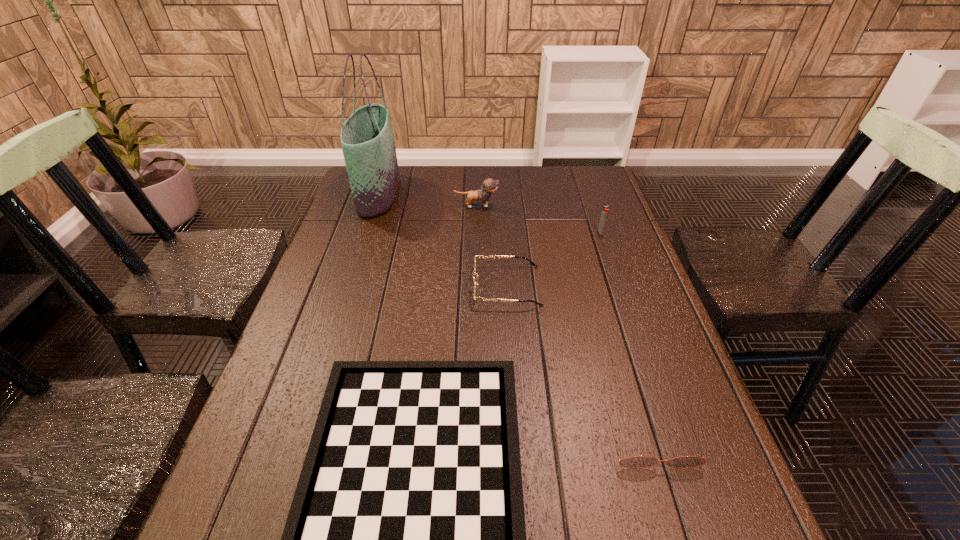
Where is `vacant space at the right edge`? This screenshot has height=540, width=960. vacant space at the right edge is located at coordinates tap(643, 434).

At what (x,y) coordinates should I click in order to perform the action: click on free space between the kitten and the tallest object. Please return your answer as a coordinate pair (x, y). The height and width of the screenshot is (540, 960). Looking at the image, I should click on (427, 200).

Find the location of `free spot between the fourth nearest object and the second shortest object`. free spot between the fourth nearest object and the second shortest object is located at coordinates (626, 336).

Locate an element on the screen. vacant region between the tote bag and the third farthest object is located at coordinates (490, 213).

Identify the location of free space between the igniter and the spectacles. This screenshot has height=540, width=960. (554, 259).

Identify the location of free area in between the tallest object and the sunglasses. click(515, 316).

I want to click on vacant area that lies between the kitten and the third nearest object, so click(x=492, y=246).

At what (x,y) coordinates should I click in order to perform the action: click on vacant point located between the igniter and the third nearest object. Please return your answer as a coordinate pair (x, y). The image size is (960, 540). Looking at the image, I should click on (554, 259).

Image resolution: width=960 pixels, height=540 pixels. What are the coordinates of `empty space between the fourth nearest object and the tallest object` in the screenshot? It's located at (490, 213).

The width and height of the screenshot is (960, 540). In order to click on empty space between the third shortest object and the fourth nearest object in this screenshot , I will do `click(554, 259)`.